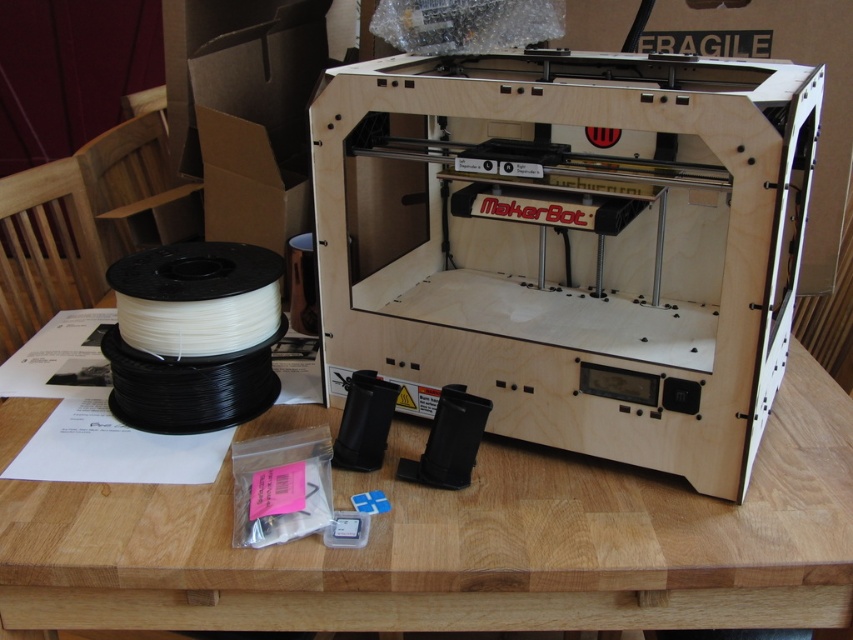
Who is lower down, wooden table at center or white matte filament at lower left?

wooden table at center

Is wooden table at center to the left of white matte filament at lower left from the viewer's perspective?

No, wooden table at center is not to the left of white matte filament at lower left.

Find the location of a particular element. This screenshot has height=640, width=853. wooden table at center is located at coordinates (461, 545).